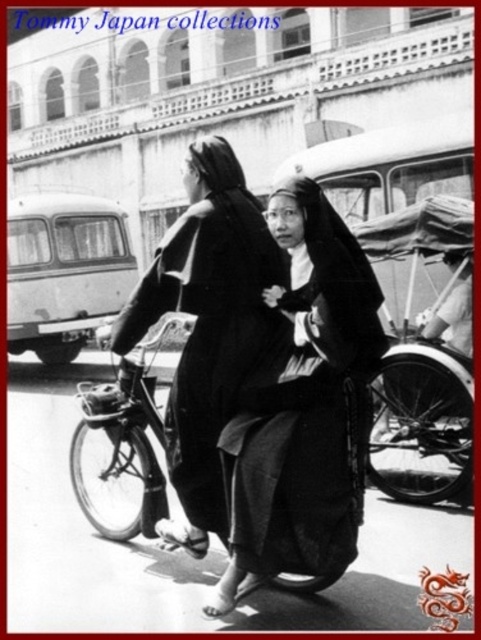
Who is shorter, smooth black robe at center or metallic bicycle at center?

metallic bicycle at center

Is point (238, 216) positioned in front of point (162, 422)?

Yes, it is.

What do you see at coordinates (207, 321) in the screenshot?
I see `smooth black robe at center` at bounding box center [207, 321].

The width and height of the screenshot is (481, 640). I want to click on smooth black robe at center, so click(x=207, y=321).

Who is lower down, black matte robe at center or wooden rickshaw at center?

wooden rickshaw at center is below.

Does point (223, 461) come closer to viewer compared to point (382, 227)?

Yes, it is.

Where is `black matte robe at center`? Image resolution: width=481 pixels, height=640 pixels. black matte robe at center is located at coordinates (307, 403).

Locate an element on the screen. This screenshot has width=481, height=640. black matte robe at center is located at coordinates (307, 403).

How far apart are black matte robe at center and metallic bicycle at center?

black matte robe at center and metallic bicycle at center are 9.30 feet apart from each other.

Can you confirm if black matte robe at center is positioned to the right of metallic bicycle at center?

Yes, black matte robe at center is to the right of metallic bicycle at center.

The height and width of the screenshot is (640, 481). Describe the element at coordinates (307, 403) in the screenshot. I see `black matte robe at center` at that location.

The width and height of the screenshot is (481, 640). I want to click on black matte robe at center, so click(x=307, y=403).